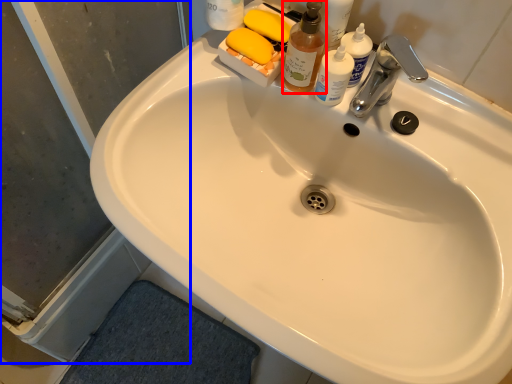
Question: Which object is further to the camera taking this photo, cleaning product (highlighted by a red box) or screen door (highlighted by a blue box)?

Choices:
 (A) cleaning product
 (B) screen door

Answer: (A)